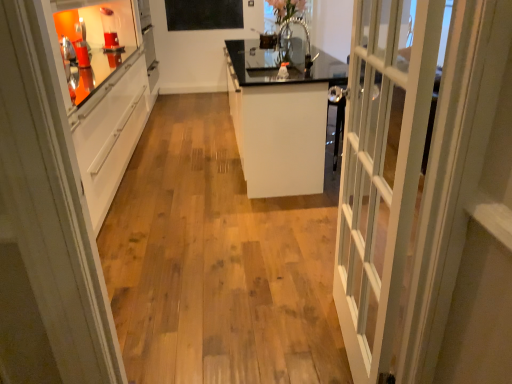
Question: From a real-world perspective, is black matte bulletin board at upper center under white glossy cabinet at center?

Choices:
 (A) no
 (B) yes

Answer: (A)

Question: From a real-world perspective, is black matte bulletin board at upper center on top of white glossy cabinet at center?

Choices:
 (A) no
 (B) yes

Answer: (B)

Question: Does black matte bulletin board at upper center have a smaller size compared to white glossy cabinet at center?

Choices:
 (A) no
 (B) yes

Answer: (B)

Question: Is black matte bulletin board at upper center positioned beyond the bounds of white glossy cabinet at center?

Choices:
 (A) yes
 (B) no

Answer: (A)

Question: Is black matte bulletin board at upper center directly adjacent to white glossy cabinet at center?

Choices:
 (A) yes
 (B) no

Answer: (B)

Question: Does black matte bulletin board at upper center appear on the left side of white glossy cabinet at center?

Choices:
 (A) yes
 (B) no

Answer: (A)

Question: Is white glossy cabinet at left surrounding black matte bulletin board at upper center?

Choices:
 (A) yes
 (B) no

Answer: (B)

Question: Is white glossy cabinet at left in front of black matte bulletin board at upper center?

Choices:
 (A) yes
 (B) no

Answer: (A)

Question: From the image's perspective, is white glossy cabinet at left located above black matte bulletin board at upper center?

Choices:
 (A) yes
 (B) no

Answer: (B)

Question: Is white glossy cabinet at left smaller than black matte bulletin board at upper center?

Choices:
 (A) no
 (B) yes

Answer: (A)

Question: Can you confirm if white glossy cabinet at left is bigger than black matte bulletin board at upper center?

Choices:
 (A) no
 (B) yes

Answer: (B)

Question: Is white glossy cabinet at left not inside black matte bulletin board at upper center?

Choices:
 (A) yes
 (B) no

Answer: (A)

Question: Is clear glass vase at upper center touching white glossy cabinet at center?

Choices:
 (A) no
 (B) yes

Answer: (A)